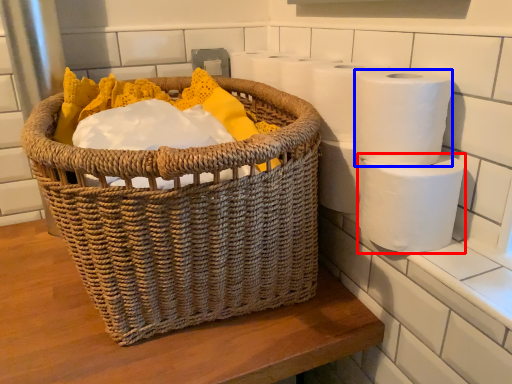
Question: Which object appears closest to the camera in this image, toilet paper (highlighted by a red box) or toilet paper (highlighted by a blue box)?

Choices:
 (A) toilet paper
 (B) toilet paper

Answer: (B)